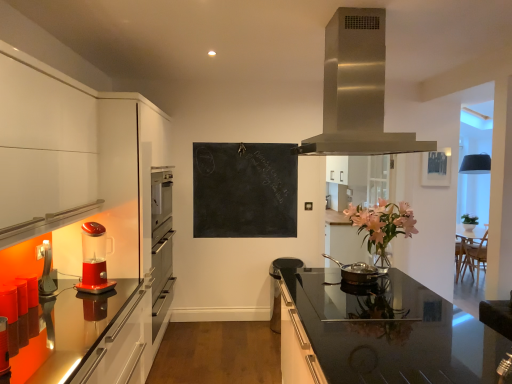
Question: Could you tell me if translucent red blender at left, which is the 1th kitchen appliance from left to right, is facing bronze metallic pan at center, which appears as the 2th kitchen appliance when viewed from the left?

Choices:
 (A) no
 (B) yes

Answer: (A)

Question: Is the position of translucent red blender at left, which is the 1th kitchen appliance from left to right, more distant than that of bronze metallic pan at center, the first kitchen appliance viewed from the right?

Choices:
 (A) no
 (B) yes

Answer: (A)

Question: Is translucent red blender at left, which is the 1th kitchen appliance from left to right, with bronze metallic pan at center, the first kitchen appliance viewed from the right?

Choices:
 (A) no
 (B) yes

Answer: (A)

Question: From the image's perspective, does translucent red blender at left, which is the 1th kitchen appliance from left to right, appear higher than bronze metallic pan at center, the first kitchen appliance viewed from the right?

Choices:
 (A) yes
 (B) no

Answer: (A)

Question: From a real-world perspective, is translucent red blender at left, which is the 1th kitchen appliance from left to right, on bronze metallic pan at center, which appears as the 2th kitchen appliance when viewed from the left?

Choices:
 (A) yes
 (B) no

Answer: (A)

Question: Considering their positions, is black glass countertop at center located in front of or behind bronze metallic pan at center, which appears as the 2th kitchen appliance when viewed from the left?

Choices:
 (A) front
 (B) behind

Answer: (A)

Question: Is black glass countertop at center wider or thinner than bronze metallic pan at center, the first kitchen appliance viewed from the right?

Choices:
 (A) thin
 (B) wide

Answer: (B)

Question: Is black glass countertop at center situated inside bronze metallic pan at center, the first kitchen appliance viewed from the right, or outside?

Choices:
 (A) inside
 (B) outside

Answer: (B)

Question: Is point (339, 319) closer or farther from the camera than point (375, 273)?

Choices:
 (A) closer
 (B) farther

Answer: (A)

Question: Choose the correct answer: Is stainless steel range hood at upper center inside metallic silver picture frame at upper right or outside it?

Choices:
 (A) outside
 (B) inside

Answer: (A)

Question: From a real-world perspective, is stainless steel range hood at upper center physically located above or below metallic silver picture frame at upper right?

Choices:
 (A) above
 (B) below

Answer: (A)

Question: In terms of width, does stainless steel range hood at upper center look wider or thinner when compared to metallic silver picture frame at upper right?

Choices:
 (A) thin
 (B) wide

Answer: (B)

Question: From their relative heights in the image, would you say stainless steel range hood at upper center is taller or shorter than metallic silver picture frame at upper right?

Choices:
 (A) tall
 (B) short

Answer: (A)

Question: Looking at their shapes, would you say translucent red blender at left, which is the 1th kitchen appliance from left to right, is wider or thinner than black chalkboard at center?

Choices:
 (A) wide
 (B) thin

Answer: (A)

Question: Would you say translucent red blender at left, which is the 1th kitchen appliance from left to right, is inside or outside black chalkboard at center?

Choices:
 (A) inside
 (B) outside

Answer: (B)